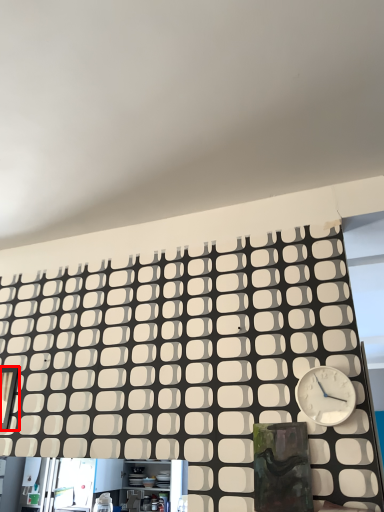
Question: From the image's perspective, considering the relative positions of window (annotated by the red box) and wall clock in the image provided, where is window (annotated by the red box) located with respect to the staircase?

Choices:
 (A) below
 (B) above

Answer: (A)